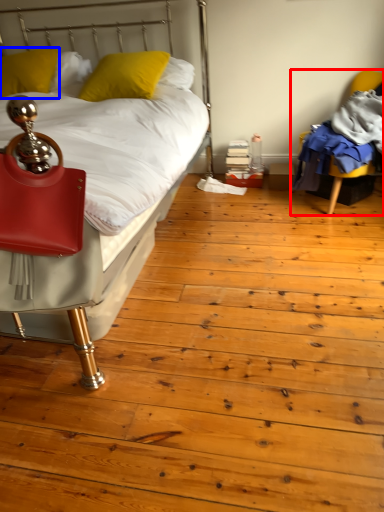
Question: Which point is closer to the camera, chair (highlighted by a red box) or pillow (highlighted by a blue box)?

Choices:
 (A) chair
 (B) pillow

Answer: (A)